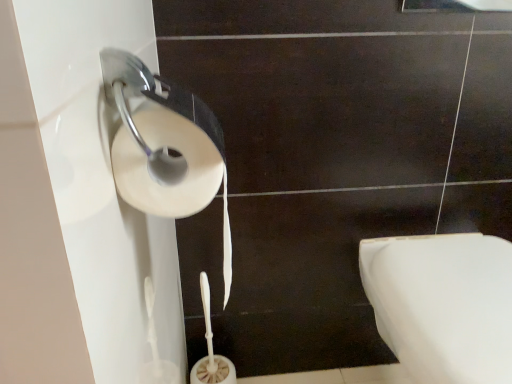
Where is `blank space above white glossy toilet at lower right (from a real-world perspective)`? This screenshot has width=512, height=384. blank space above white glossy toilet at lower right (from a real-world perspective) is located at coordinates (463, 276).